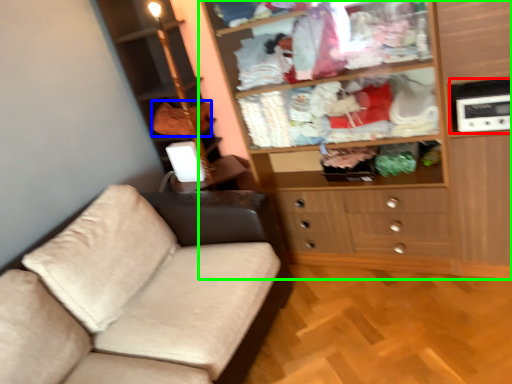
Question: Which is nearer to the appliance (highlighted by a red box)? clothing (highlighted by a blue box) or cupboard (highlighted by a green box).

Choices:
 (A) clothing
 (B) cupboard

Answer: (B)